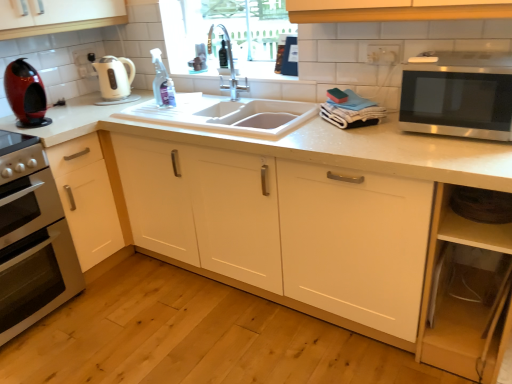
Question: Is silver metallic faucet at center wider than shiny red coffee machine at left?

Choices:
 (A) no
 (B) yes

Answer: (A)

Question: Considering the relative positions of silver metallic faucet at center and shiny red coffee machine at left in the image provided, is silver metallic faucet at center to the right of shiny red coffee machine at left from the viewer's perspective?

Choices:
 (A) no
 (B) yes

Answer: (B)

Question: Does silver metallic faucet at center appear on the left side of shiny red coffee machine at left?

Choices:
 (A) yes
 (B) no

Answer: (B)

Question: Does silver metallic faucet at center have a greater height compared to shiny red coffee machine at left?

Choices:
 (A) no
 (B) yes

Answer: (A)

Question: Is silver metallic faucet at center oriented towards shiny red coffee machine at left?

Choices:
 (A) no
 (B) yes

Answer: (A)

Question: Visually, is white matte cabinet at lower left, which ranks as the first cabinetry in left-to-right order, positioned to the left or to the right of silver metallic faucet at center?

Choices:
 (A) left
 (B) right

Answer: (A)

Question: From the image's perspective, is white matte cabinet at lower left, positioned as the second cabinetry in right-to-left order, positioned above or below silver metallic faucet at center?

Choices:
 (A) above
 (B) below

Answer: (B)

Question: Does point (83, 198) appear closer or farther from the camera than point (230, 49)?

Choices:
 (A) farther
 (B) closer

Answer: (B)

Question: From a real-world perspective, is white matte cabinet at lower left, positioned as the second cabinetry in right-to-left order, positioned above or below silver metallic faucet at center?

Choices:
 (A) below
 (B) above

Answer: (A)

Question: Considering the positions of point (38, 125) and point (34, 233), is point (38, 125) closer or farther from the camera than point (34, 233)?

Choices:
 (A) closer
 (B) farther

Answer: (B)

Question: From a real-world perspective, is shiny red coffee machine at left physically located above or below white glossy oven at left?

Choices:
 (A) below
 (B) above

Answer: (B)

Question: From the image's perspective, is shiny red coffee machine at left positioned above or below white glossy oven at left?

Choices:
 (A) below
 (B) above

Answer: (B)

Question: Relative to white glossy oven at left, is shiny red coffee machine at left in front or behind?

Choices:
 (A) front
 (B) behind

Answer: (B)

Question: In terms of width, does white glossy oven at left look wider or thinner when compared to white matte cabinet at lower left, positioned as the second cabinetry in right-to-left order?

Choices:
 (A) wide
 (B) thin

Answer: (A)

Question: Is white glossy oven at left to the left or to the right of white matte cabinet at lower left, which ranks as the first cabinetry in left-to-right order, in the image?

Choices:
 (A) left
 (B) right

Answer: (A)